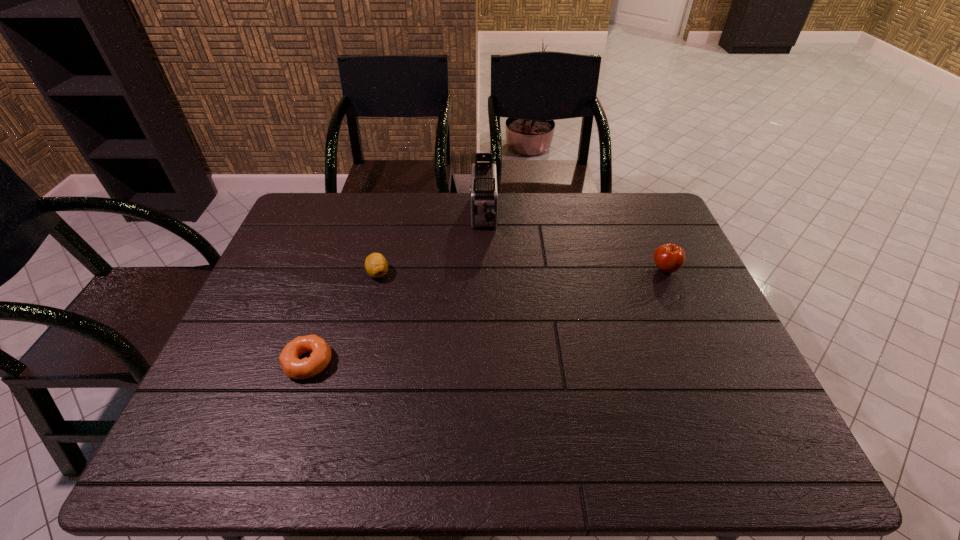
This screenshot has width=960, height=540. In the image, there is a desktop. Identify the location of vacant region at the near left corner. (230, 465).

Where is `vacant space at the far right corner of the desktop`? Image resolution: width=960 pixels, height=540 pixels. vacant space at the far right corner of the desktop is located at coordinates (653, 230).

The height and width of the screenshot is (540, 960). In order to click on vacant space at the near right corner of the desktop in this screenshot , I will do `click(738, 433)`.

The height and width of the screenshot is (540, 960). What are the coordinates of `free point between the nearest object and the rightmost object` in the screenshot? It's located at pos(487,316).

Identify the location of blank region between the doughnut and the rightmost object. (487, 316).

Where is `free space between the third tallest object and the rightmost object`? This screenshot has height=540, width=960. free space between the third tallest object and the rightmost object is located at coordinates (521, 271).

At what (x,y) coordinates should I click in order to perform the action: click on empty space between the apple and the camcorder. Please return your answer as a coordinate pair (x, y). The image size is (960, 540). Looking at the image, I should click on (574, 242).

In order to click on free spot between the camcorder and the apple in this screenshot , I will do (574, 242).

The height and width of the screenshot is (540, 960). In order to click on empty location between the leftmost object and the farthest object in this screenshot , I will do `click(396, 288)`.

The width and height of the screenshot is (960, 540). I want to click on vacant space in between the third shortest object and the doughnut, so click(487, 316).